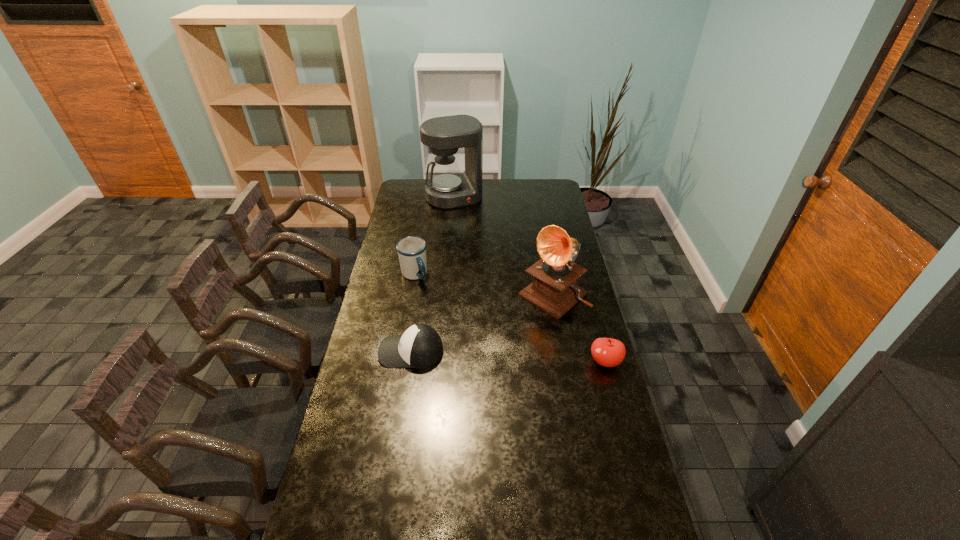
Find the location of a particular element. The height and width of the screenshot is (540, 960). cap is located at coordinates (420, 346).

Image resolution: width=960 pixels, height=540 pixels. I want to click on apple, so click(607, 352).

The image size is (960, 540). I want to click on the third shortest object, so click(x=411, y=250).

The image size is (960, 540). I want to click on phonograph record, so click(554, 289).

I want to click on the farthest object, so click(x=448, y=188).

This screenshot has height=540, width=960. What are the coordinates of `vacant region located 0.230m on the back of the apple` in the screenshot? It's located at (590, 307).

Locate an element on the screen. This screenshot has height=540, width=960. vacant space located 0.130m on the handle side of the mug is located at coordinates (437, 301).

Locate an element on the screen. free location located on the handle side of the mug is located at coordinates (428, 292).

Identify the location of vacant area situated 0.370m on the handle side of the mug. click(468, 336).

Identify the location of free spot located on the horn of the phonograph record. The width and height of the screenshot is (960, 540). (500, 338).